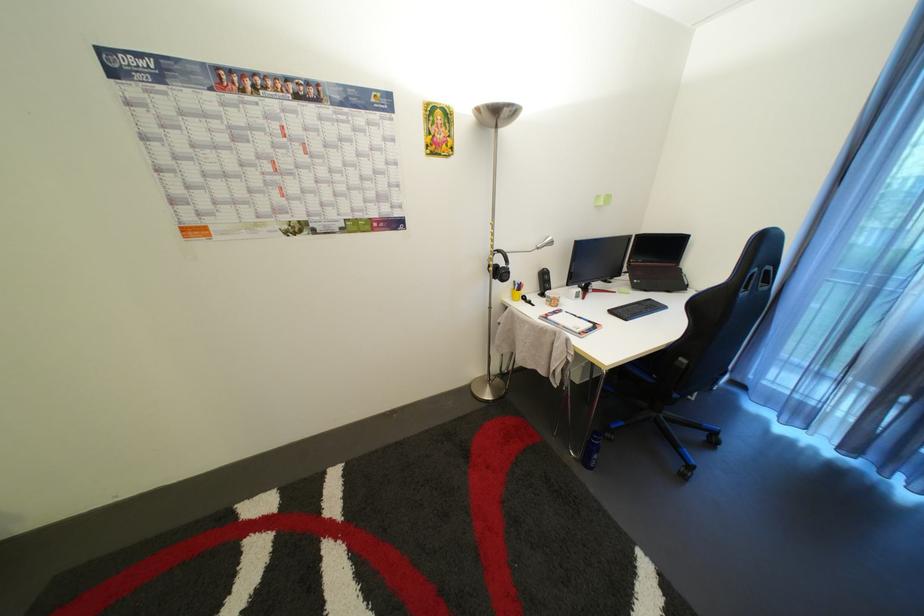
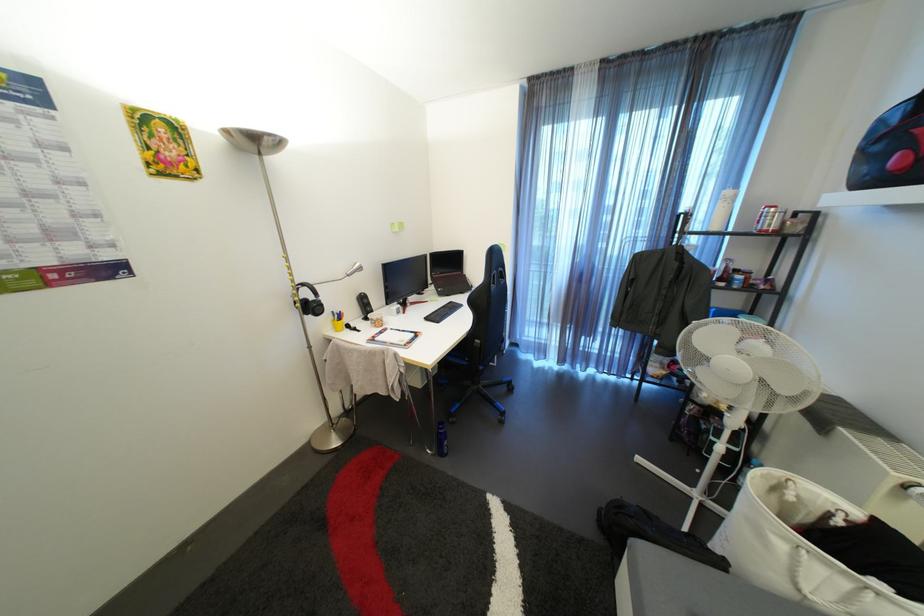
Question: The camera is either moving clockwise (left) or counter-clockwise (right) around the object. The first image is from the beginning of the video and the second image is from the end. Is the camera moving left or right when shooting the video?

Choices:
 (A) Left
 (B) Right

Answer: (A)